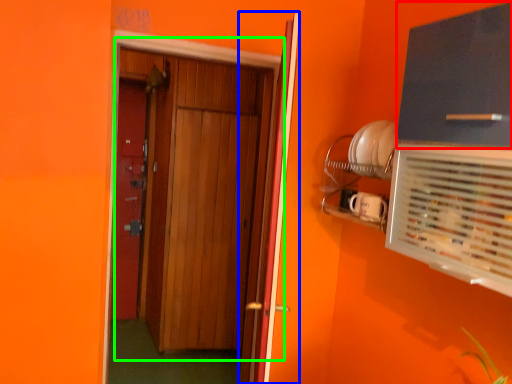
Question: Which is farther away from cabinetry (highlighted by a red box)? door (highlighted by a blue box) or door (highlighted by a green box)?

Choices:
 (A) door
 (B) door

Answer: (B)